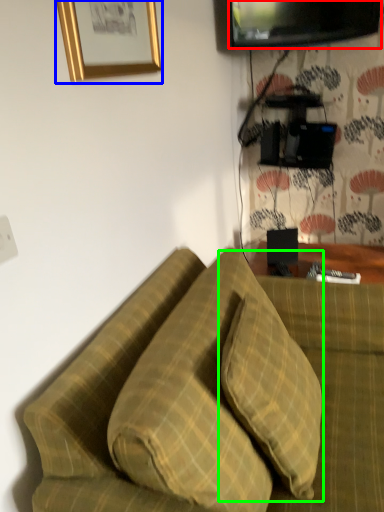
Question: Considering the real-world distances, which object is farthest from television (highlighted by a red box)? picture frame (highlighted by a blue box) or pillow (highlighted by a green box)?

Choices:
 (A) picture frame
 (B) pillow

Answer: (B)